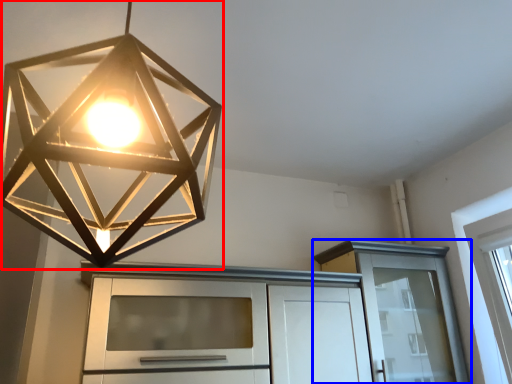
Question: Which point is further to the camera, lamp (highlighted by a red box) or cabinetry (highlighted by a blue box)?

Choices:
 (A) lamp
 (B) cabinetry

Answer: (B)